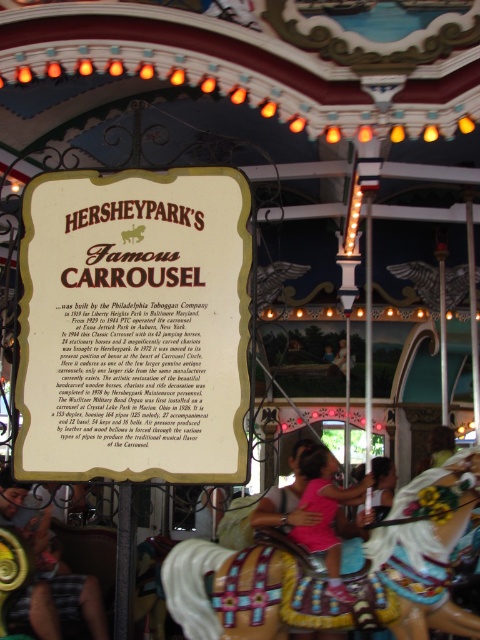
Looking at this image, you are a visitor at Hersheypark and want to read the white paper sign at center. There is a wooden painted horse at center blocking your view. Can you see the sign without moving the horse?

The white paper sign at center is above the wooden painted horse at center, so you can see the sign without moving the horse because it is positioned above the horse.

You are standing at the entrance of Hersheypark and see the carousel signboard. There is a specific point on the signboard at coordinates point (156, 182). If you want to throw a small ball to hit that exact point, and your throwing range is up to 50 meters, will you be able to reach it?

The distance of point (156, 182) from the viewer is 48.07 meters, which is within your throwing range of up to 50 meters. Therefore, you can reach the point by throwing the ball.